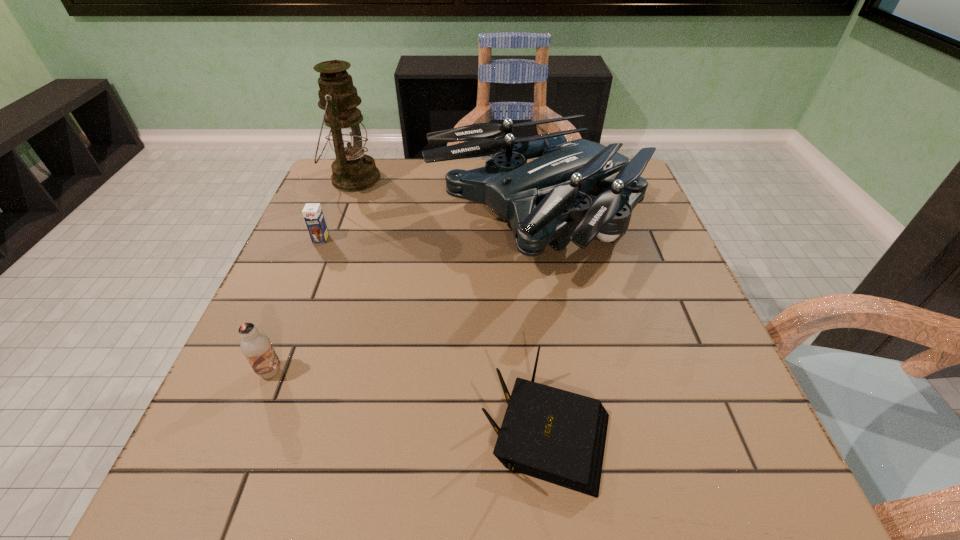
At what (x,y) coordinates should I click in order to perform the action: click on vacant space located on the back of the router. Please return your answer as a coordinate pair (x, y). Looking at the image, I should click on (528, 269).

This screenshot has width=960, height=540. What are the coordinates of `oil lamp at the far edge` in the screenshot? It's located at (352, 171).

Where is `drone that is at the far edge`? drone that is at the far edge is located at coordinates (546, 200).

Find the location of a particular element. This screenshot has height=540, width=960. object positioned at the near edge is located at coordinates (557, 436).

This screenshot has height=540, width=960. What are the coordinates of `oil lamp at the left edge` in the screenshot? It's located at (352, 171).

Where is `object that is positioned at the right edge`? object that is positioned at the right edge is located at coordinates (546, 200).

This screenshot has width=960, height=540. Find the location of `object at the far left corner`. object at the far left corner is located at coordinates (352, 171).

What are the coordinates of `object present at the far right corner` in the screenshot? It's located at (546, 200).

The width and height of the screenshot is (960, 540). Identify the location of free region at the far edge of the desktop. tap(400, 170).

In the image, there is a desktop. Find the location of `vacant area at the left edge`. vacant area at the left edge is located at coordinates click(x=330, y=322).